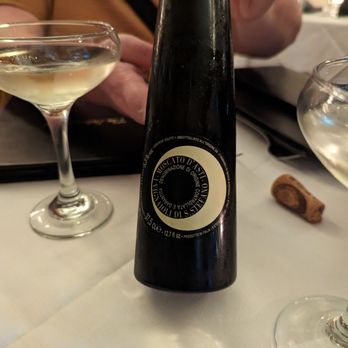
Where is `cork`? The width and height of the screenshot is (348, 348). cork is located at coordinates (303, 196).